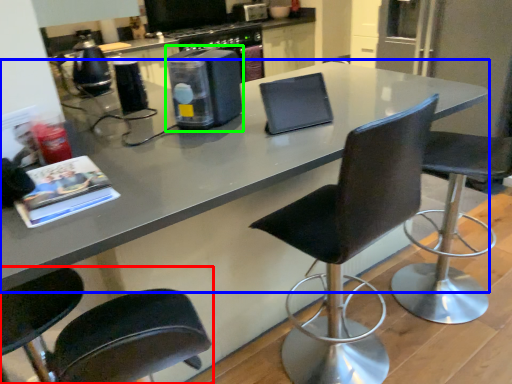
Question: Which object is the farthest from chair (highlighted by a red box)? Choose among these: countertop (highlighted by a blue box) or appliance (highlighted by a green box).

Choices:
 (A) countertop
 (B) appliance

Answer: (B)